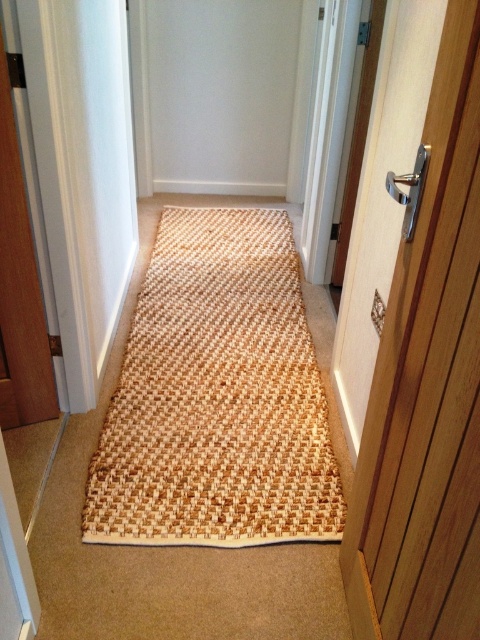
Question: Which point is closer to the camera taking this photo?

Choices:
 (A) (362, 480)
 (B) (154, 264)

Answer: (A)

Question: Which point is farther to the camera?

Choices:
 (A) (349, 572)
 (B) (269, 371)

Answer: (B)

Question: Can you confirm if natural woven mat at center is wider than wooden door at right?

Choices:
 (A) no
 (B) yes

Answer: (B)

Question: Does natural woven mat at center appear under wooden door at right?

Choices:
 (A) no
 (B) yes

Answer: (A)

Question: In this image, where is natural woven mat at center located relative to wooden door at right?

Choices:
 (A) right
 (B) left

Answer: (B)